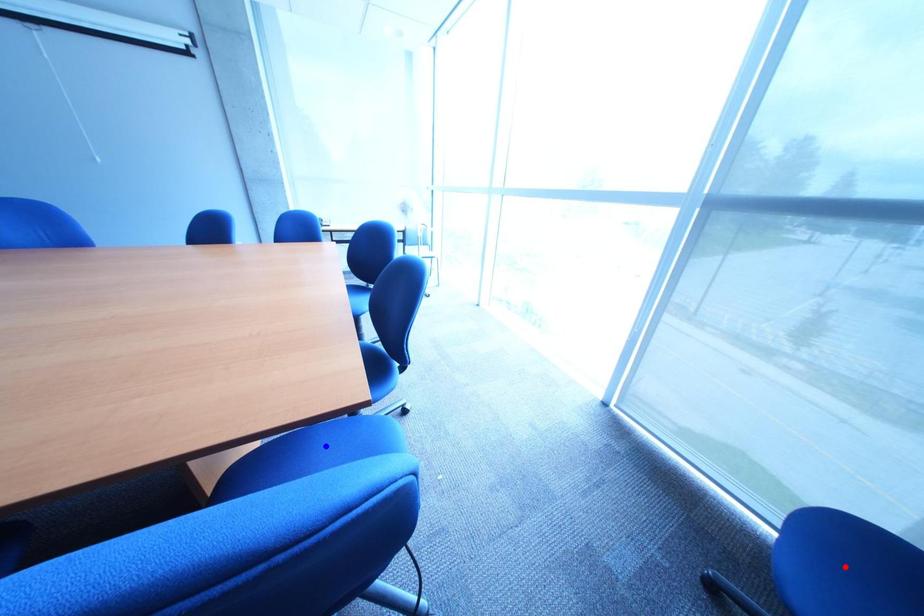
Question: Which of the two points in the image is closer to the camera?

Choices:
 (A) Blue point is closer.
 (B) Red point is closer.

Answer: (B)